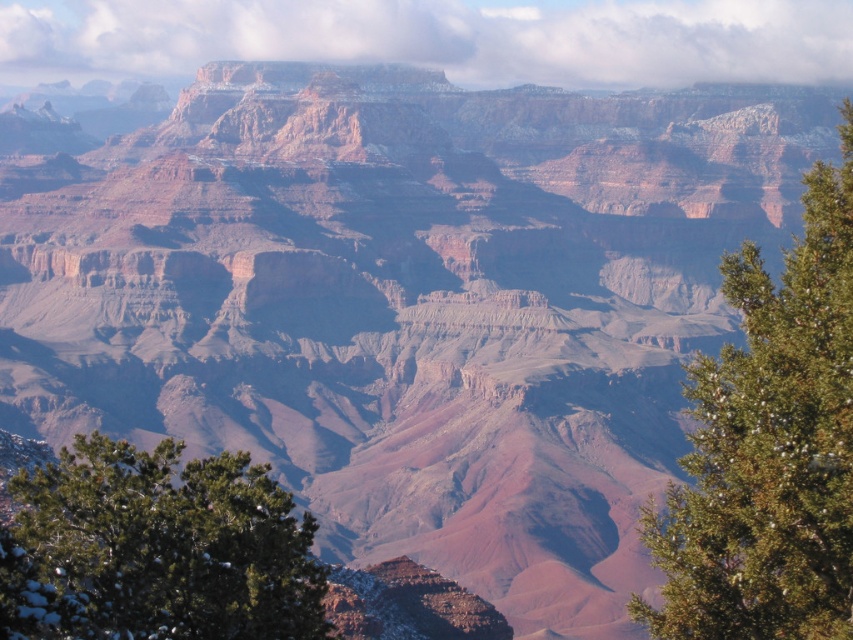
You are standing at the edge of the Grand Canyon and see the two green textured pine trees. Which pine tree is closer to you, the green textured pine tree at right or the green textured pine tree at lower left?

The green textured pine tree at right is closer to you because it is positioned in front of the green textured pine tree at lower left.

You are standing at the viewpoint overlooking the Grand Canyon and see two points marked on the image. The first point is at coordinates point (801, 424) and the second is at point (148, 588). If you were to walk towards the second point, would you pass by the first point before reaching it?

Yes, because point (801, 424) is in front of point (148, 588), so you would pass by the first point before reaching the second one.

Based on the photo, you are planning to take a photo of the Grand Canyon with both the green textured pine tree at right and the green textured pine tree at lower left in the frame. Which pine tree should you focus on to ensure it appears larger in the photo?

You should focus on the green textured pine tree at right because it is bigger than the green textured pine tree at lower left, so it will naturally appear larger in the photo.